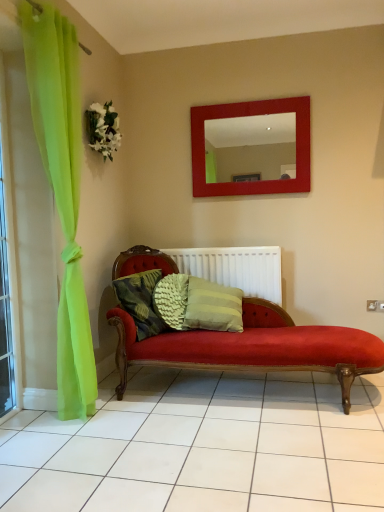
Identify the location of free location above red glossy mirror at upper center (from a real-world perspective). (253, 95).